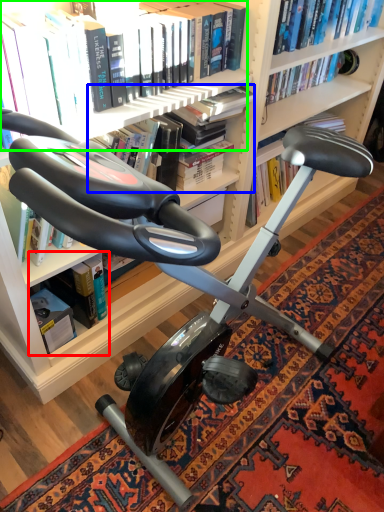
Question: Considering the real-world distances, which object is farthest from book (highlighted by a red box)? book (highlighted by a blue box) or book (highlighted by a green box)?

Choices:
 (A) book
 (B) book

Answer: (B)